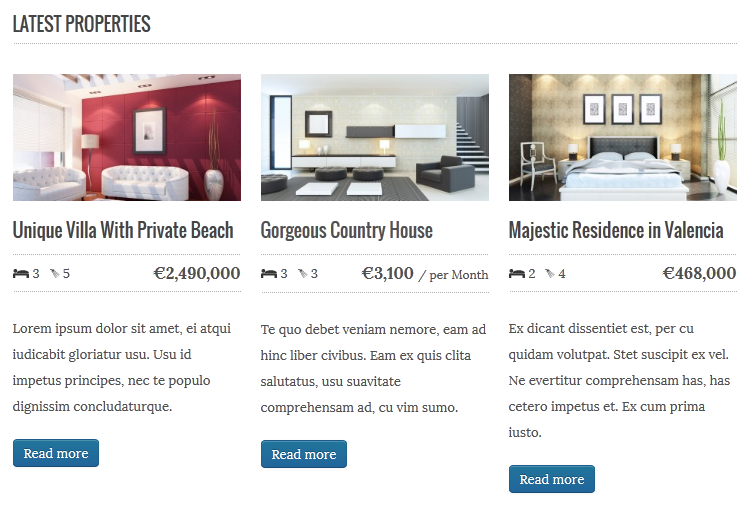
This screenshot has height=520, width=754. In order to click on pictures in this screenshot , I will do `click(587, 106)`, `click(621, 109)`, `click(648, 112)`, `click(143, 130)`.